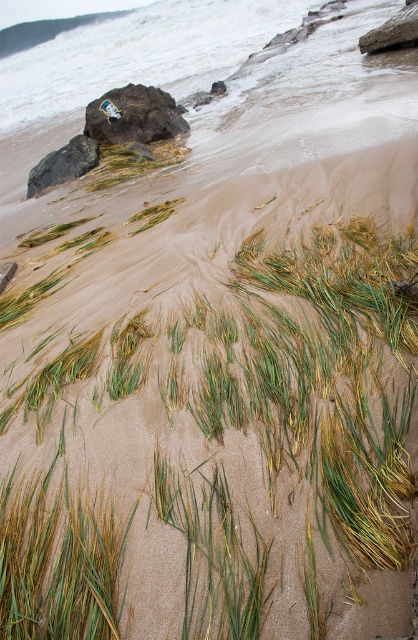
Which of these two, rusty metallic rock at upper left or dark gray rock at left, stands shorter?

dark gray rock at left

Looking at this image, can you confirm if rusty metallic rock at upper left is thinner than dark gray rock at left?

In fact, rusty metallic rock at upper left might be wider than dark gray rock at left.

Where is `rusty metallic rock at upper left`? rusty metallic rock at upper left is located at coordinates (134, 115).